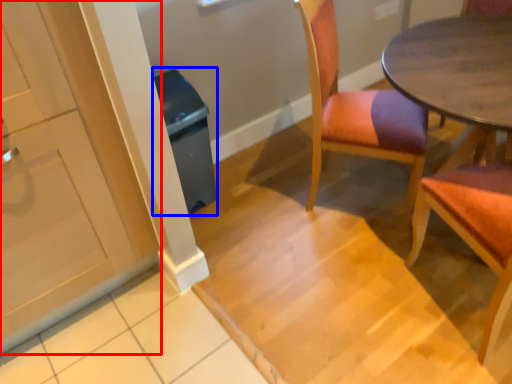
Question: Which object is closer to the camera taking this photo, cabinetry (highlighted by a red box) or trash bin/can (highlighted by a blue box)?

Choices:
 (A) cabinetry
 (B) trash bin/can

Answer: (A)